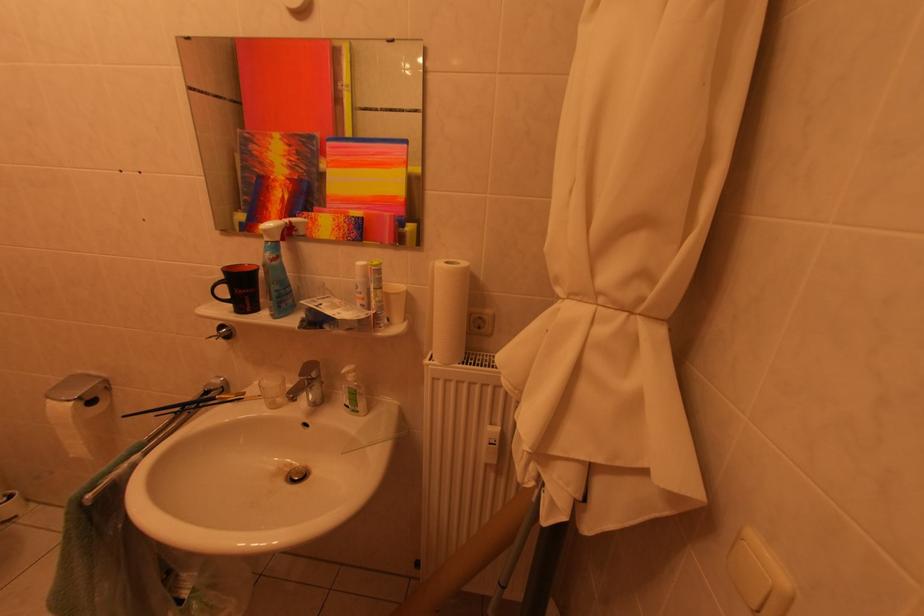
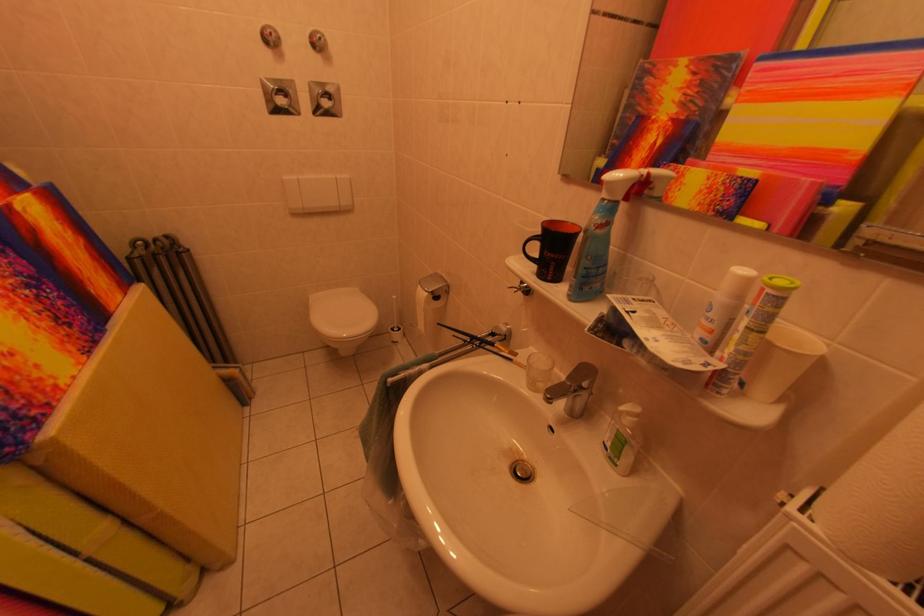
Find the pixel in the second image that matches [251,395] in the first image.

(526, 355)